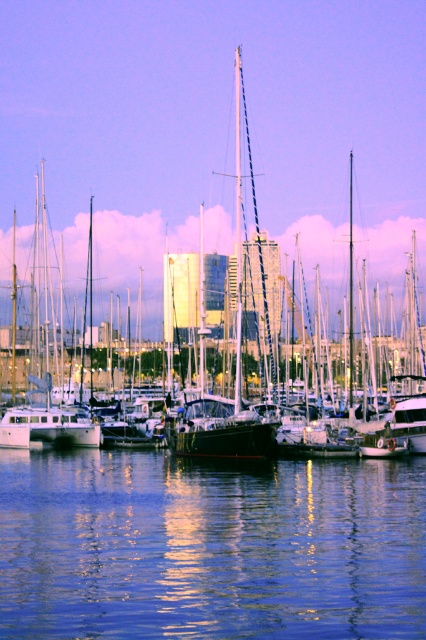
Does blue reflective water at center have a lesser width compared to shiny black sailboat at center?

Yes.

This screenshot has width=426, height=640. In order to click on blue reflective water at center in this screenshot , I will do `click(210, 547)`.

Between point (127, 484) and point (37, 189), which one is positioned behind?

The point (37, 189) is behind.

Find the location of `blue reflective water at center`. blue reflective water at center is located at coordinates (210, 547).